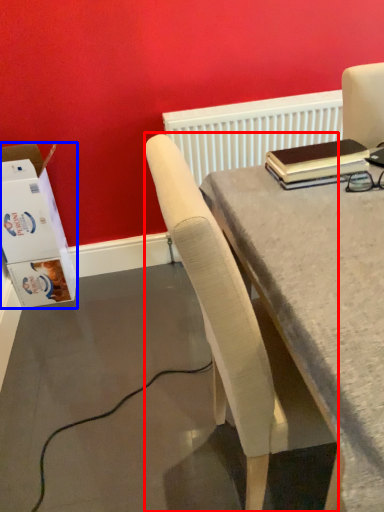
Question: Which object is further to the camera taking this photo, chair (highlighted by a red box) or box (highlighted by a blue box)?

Choices:
 (A) chair
 (B) box

Answer: (B)